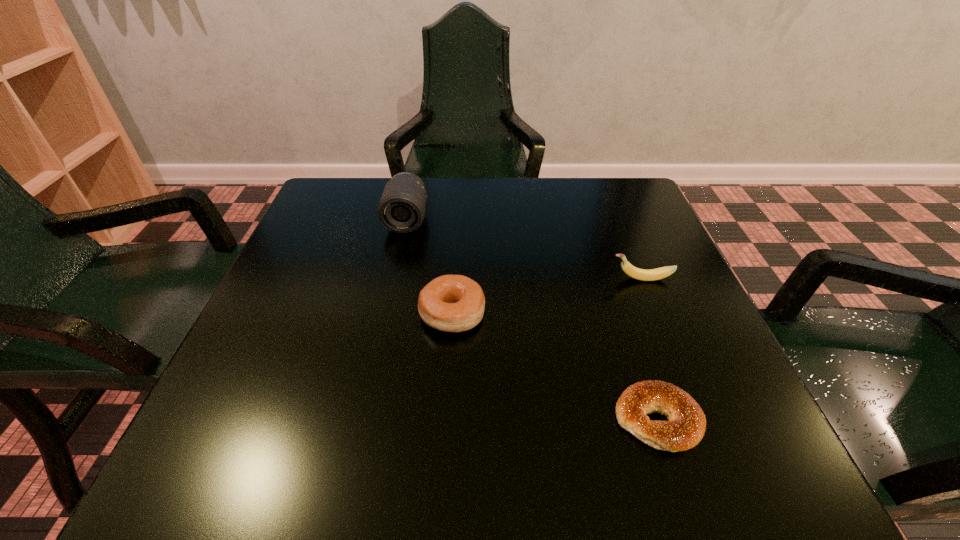
Where is `vacant region that satisfies the following two spatial constraints: 1. on the front side of the nearer bagel; 2. on the left side of the second object from left to right`? vacant region that satisfies the following two spatial constraints: 1. on the front side of the nearer bagel; 2. on the left side of the second object from left to right is located at coordinates (445, 419).

Where is `free space that satisfies the following two spatial constraints: 1. on the surface of the leftmost object; 2. on the right side of the farther bagel`? The width and height of the screenshot is (960, 540). free space that satisfies the following two spatial constraints: 1. on the surface of the leftmost object; 2. on the right side of the farther bagel is located at coordinates (386, 314).

Locate an element on the screen. The height and width of the screenshot is (540, 960). free point that satisfies the following two spatial constraints: 1. on the surface of the left bagel; 2. on the right side of the farthest object is located at coordinates pyautogui.click(x=386, y=314).

In order to click on blank space that satisfies the following two spatial constraints: 1. on the surface of the tallest object; 2. on the right side of the shortest object in this screenshot , I will do click(x=363, y=419).

Find the location of a particular element. The width and height of the screenshot is (960, 540). free spot that satisfies the following two spatial constraints: 1. on the surface of the shortest object; 2. on the left side of the farthest object is located at coordinates (363, 419).